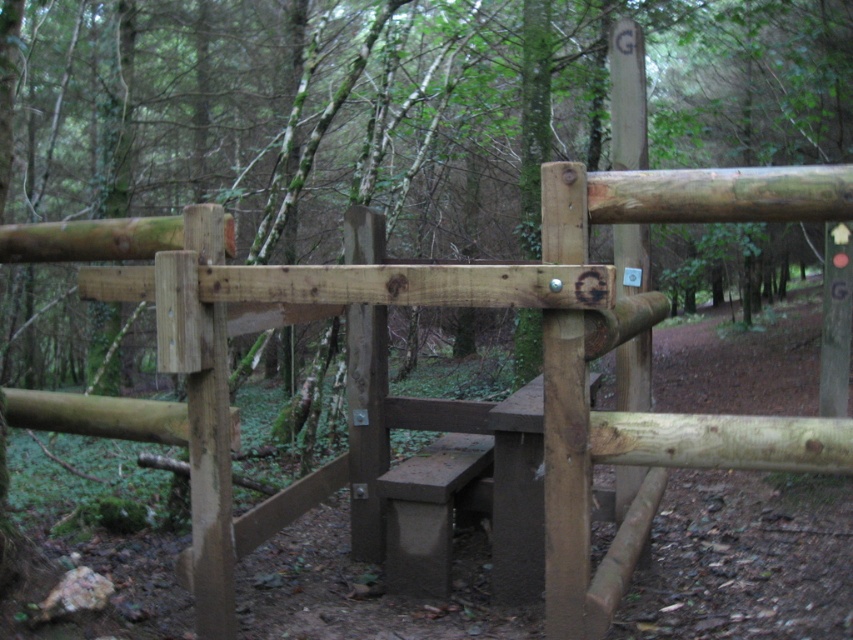
Question: Estimate the real-world distances between objects in this image. Which object is farther from the natural wood gate at center?

Choices:
 (A) natural wood fence at center
 (B) concrete bench at center

Answer: (A)

Question: Can you confirm if natural wood fence at center is bigger than natural wood gate at center?

Choices:
 (A) yes
 (B) no

Answer: (B)

Question: Which point is farther from the camera taking this photo?

Choices:
 (A) (215, 609)
 (B) (15, 369)

Answer: (B)

Question: Observing the image, what is the correct spatial positioning of natural wood gate at center in reference to concrete bench at center?

Choices:
 (A) above
 (B) below

Answer: (A)

Question: Can you confirm if natural wood gate at center is wider than concrete bench at center?

Choices:
 (A) yes
 (B) no

Answer: (A)

Question: Among these objects, which one is farthest from the camera?

Choices:
 (A) natural wood fence at center
 (B) concrete bench at center

Answer: (A)